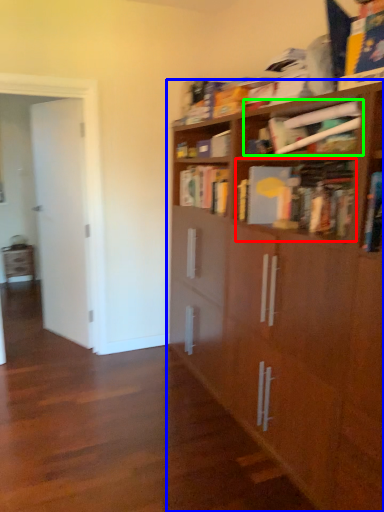
Question: Which object is positioned closest to book (highlighted by a red box)? Select from bookcase (highlighted by a blue box) and book (highlighted by a green box).

Choices:
 (A) bookcase
 (B) book

Answer: (B)